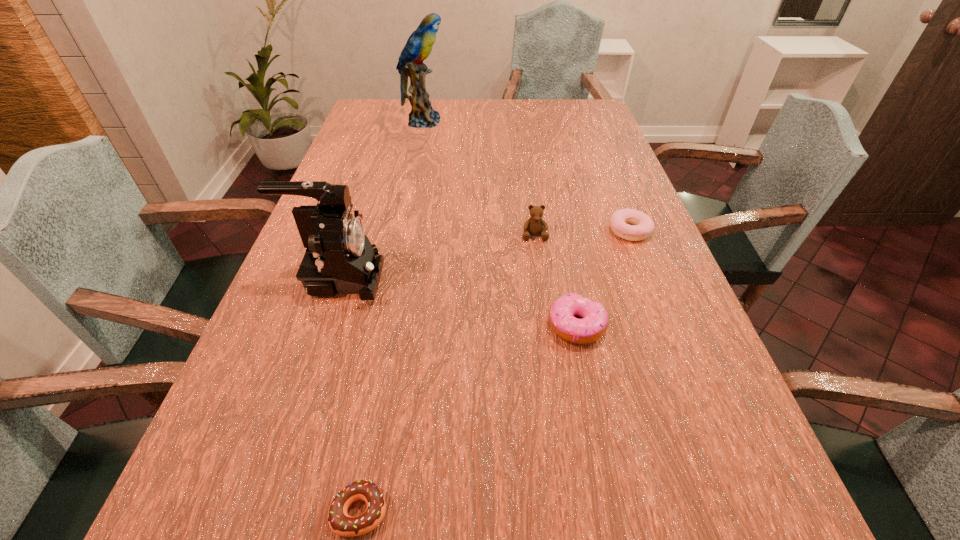
Where is `vacant space located on the lens mount of the camcorder`? This screenshot has width=960, height=540. vacant space located on the lens mount of the camcorder is located at coordinates click(423, 278).

Where is `free location located 0.090m on the front-facing side of the teddy bear`? free location located 0.090m on the front-facing side of the teddy bear is located at coordinates (540, 267).

The height and width of the screenshot is (540, 960). I want to click on free space located on the front of the second doughnut from left to right, so click(597, 427).

Locate an element on the screen. Image resolution: width=960 pixels, height=540 pixels. vacant area located on the front of the second shortest object is located at coordinates tap(668, 329).

Image resolution: width=960 pixels, height=540 pixels. Find the location of `free space located 0.110m on the back of the nearest object`. free space located 0.110m on the back of the nearest object is located at coordinates (376, 418).

Where is `object located in the far edge section of the desktop`? Image resolution: width=960 pixels, height=540 pixels. object located in the far edge section of the desktop is located at coordinates (419, 45).

Locate an element on the screen. This screenshot has height=540, width=960. parrot situated at the left edge is located at coordinates (419, 45).

Where is `camcorder located in the left edge section of the desktop`? The image size is (960, 540). camcorder located in the left edge section of the desktop is located at coordinates pos(339,258).

Image resolution: width=960 pixels, height=540 pixels. What are the coordinates of `object situated at the right edge` in the screenshot? It's located at coord(642,225).

Identify the location of object that is at the far left corner. (419, 45).